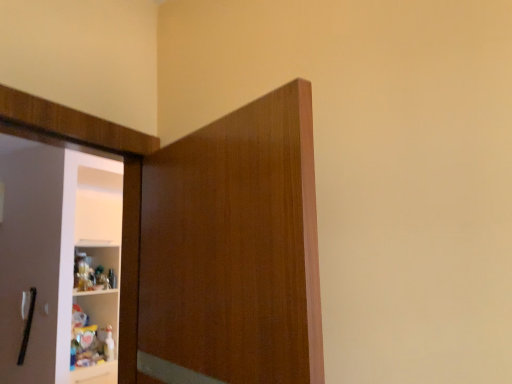
Question: Considering their positions, is matte wood cupboard at center located in front of or behind black matte door handle at left?

Choices:
 (A) behind
 (B) front

Answer: (B)

Question: Looking at their shapes, would you say matte wood cupboard at center is wider or thinner than black matte door handle at left?

Choices:
 (A) thin
 (B) wide

Answer: (B)

Question: Considering the relative positions of matte wood cupboard at center and black matte door handle at left in the image provided, is matte wood cupboard at center to the left or to the right of black matte door handle at left?

Choices:
 (A) right
 (B) left

Answer: (A)

Question: From the image's perspective, is black matte door handle at left positioned above or below matte wood cupboard at center?

Choices:
 (A) below
 (B) above

Answer: (A)

Question: Is point (25, 345) closer or farther from the camera than point (161, 281)?

Choices:
 (A) farther
 (B) closer

Answer: (A)

Question: From a real-world perspective, relative to matte wood cupboard at center, is black matte door handle at left vertically above or below?

Choices:
 (A) below
 (B) above

Answer: (A)

Question: Relative to matte wood cupboard at center, is black matte door handle at left in front or behind?

Choices:
 (A) behind
 (B) front

Answer: (A)